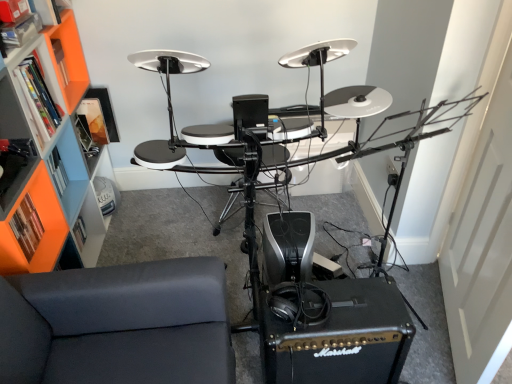
Question: Relative to orange plastic bookshelf at left, is orange matte bookshelf at left, which is the 2th shelf from top to bottom, in front or behind?

Choices:
 (A) front
 (B) behind

Answer: (B)

Question: Based on their positions, is orange matte bookshelf at left, which is the 2th shelf from top to bottom, located to the left or right of orange plastic bookshelf at left?

Choices:
 (A) left
 (B) right

Answer: (B)

Question: Considering the real-world distances, which object is farthest from the orange plastic bookshelf at left?

Choices:
 (A) orange matte bookshelf at left, which is the 2th shelf from top to bottom
 (B) orange plastic shelf at left, marked as the 1th shelf in a top-to-bottom arrangement
 (C) dark gray fabric couch at lower left

Answer: (C)

Question: Estimate the real-world distances between objects in this image. Which object is closer to the orange plastic bookshelf at left?

Choices:
 (A) orange matte bookshelf at left, which is the first shelf from bottom to top
 (B) orange plastic shelf at left, which ranks as the second shelf in bottom-to-top order
 (C) dark gray fabric couch at lower left

Answer: (A)